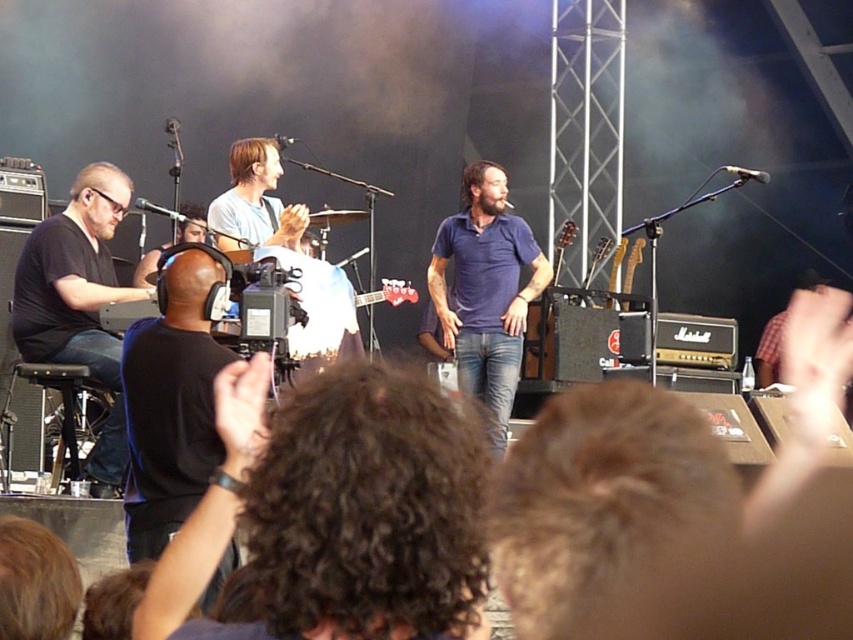
Question: Which of the following is the closest to the observer?

Choices:
 (A) (465, 330)
 (B) (119, 394)

Answer: (B)

Question: Among these points, which one is farthest from the camera?

Choices:
 (A) (436, 307)
 (B) (390, 609)

Answer: (A)

Question: Which of these objects is positioned farthest from the dark curly hair at lower center?

Choices:
 (A) blue cotton shirt at center
 (B) black matte headphones at left

Answer: (A)

Question: In this image, where is dark curly hair at lower center located relative to black matte headphones at left?

Choices:
 (A) below
 (B) above

Answer: (A)

Question: Does dark curly hair at lower center have a greater width compared to blue cotton shirt at center?

Choices:
 (A) yes
 (B) no

Answer: (B)

Question: Can you confirm if dark curly hair at lower center is wider than black matte headphones at left?

Choices:
 (A) yes
 (B) no

Answer: (B)